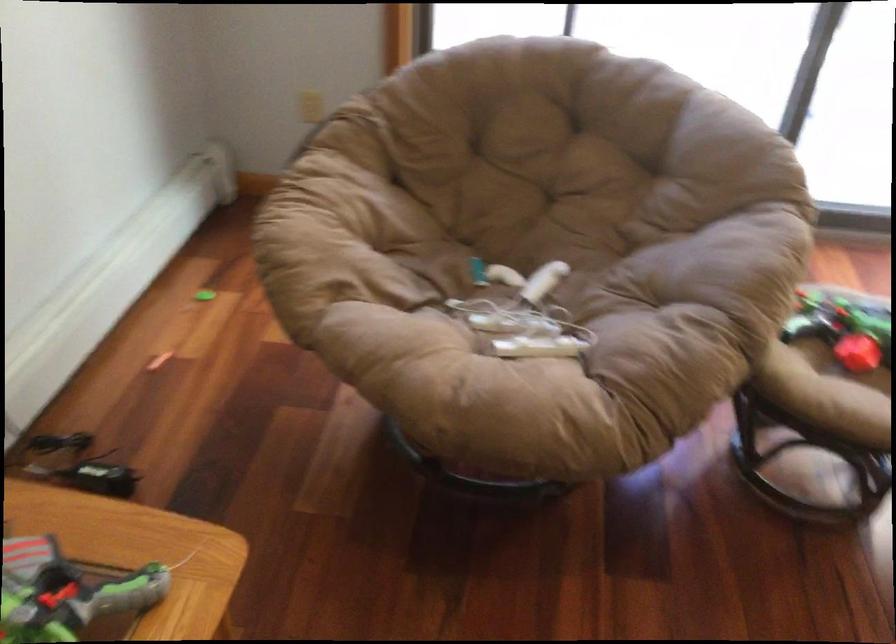
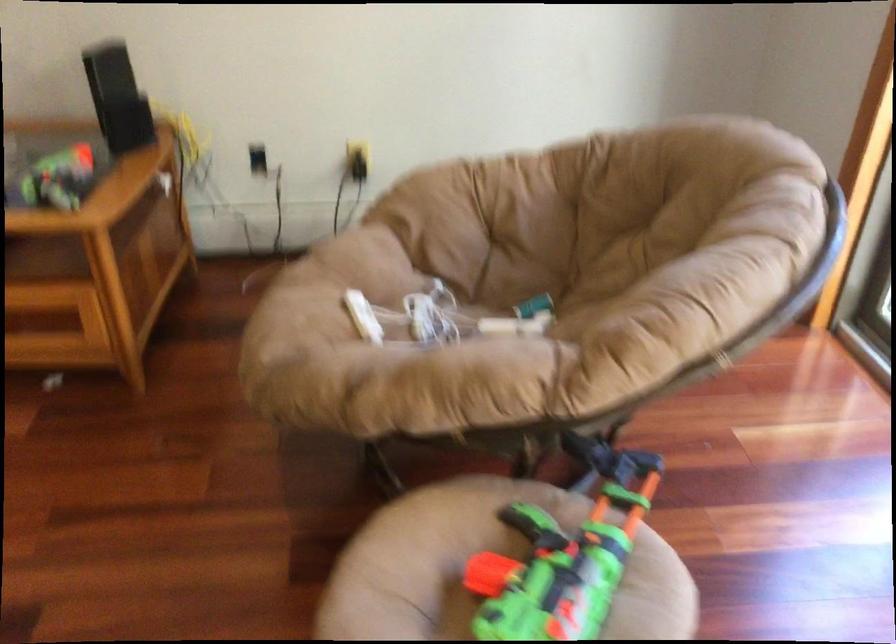
Where in the second image is the point corresponding to point 805,326 from the first image?

(530, 520)